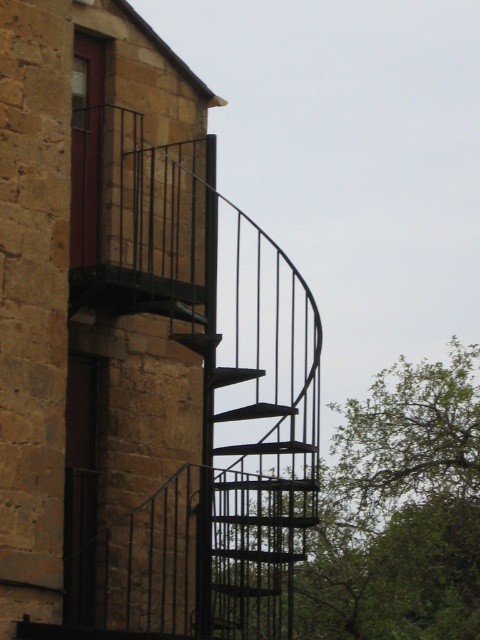
You are a drone operator who needs to fly a drone from the matte black staircase at upper right to the green leafy tree at right. The drone has a maximum range of 35 meters. Can the drone reach the tree without losing signal?

The matte black staircase at upper right is 37.11 meters away from the green leafy tree at right. Since the drone can only fly up to 35 meters, it cannot reach the tree without losing signal.

You are standing at the base of the spiral staircase in the image. You want to know where the staircase leads. Based on the coordinates provided, which direction does the staircase at point (85,296) face?

The point (85,296) indicates the matte black staircase at upper right, so the staircase faces upwards and to the right.